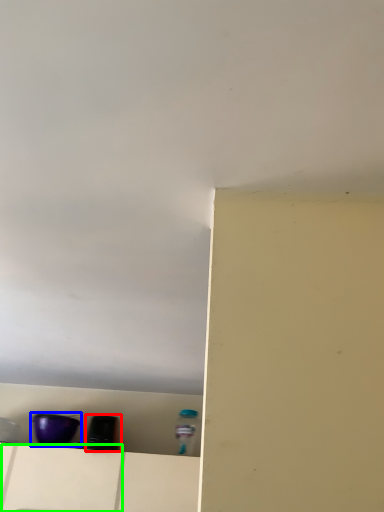
Question: Which is nearer to the appliance (highlighted by a red box)? appliance (highlighted by a blue box) or drawer (highlighted by a green box).

Choices:
 (A) appliance
 (B) drawer

Answer: (A)